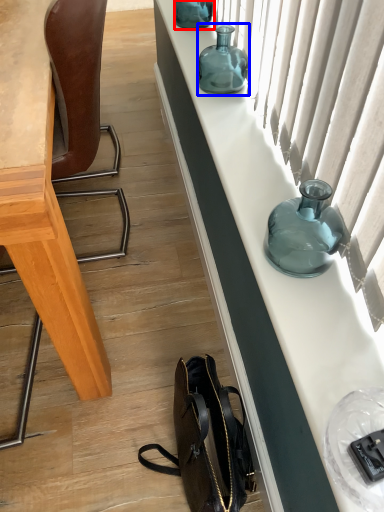
Question: Which of the following is the farthest to the observer, bottle (highlighted by a red box) or bottle (highlighted by a blue box)?

Choices:
 (A) bottle
 (B) bottle

Answer: (A)